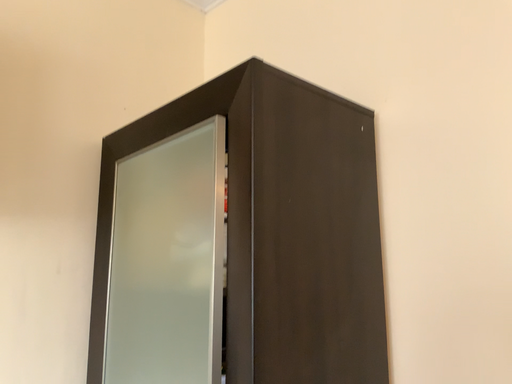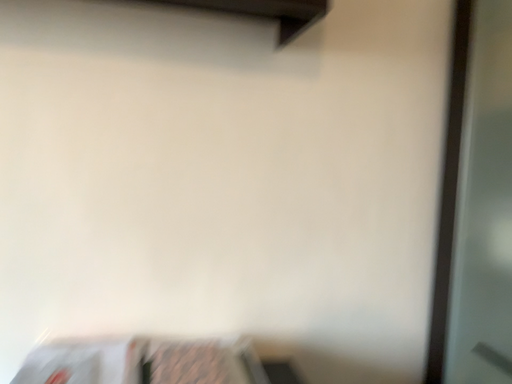
Question: How did the camera likely rotate when shooting the video?

Choices:
 (A) rotated right
 (B) rotated left

Answer: (B)